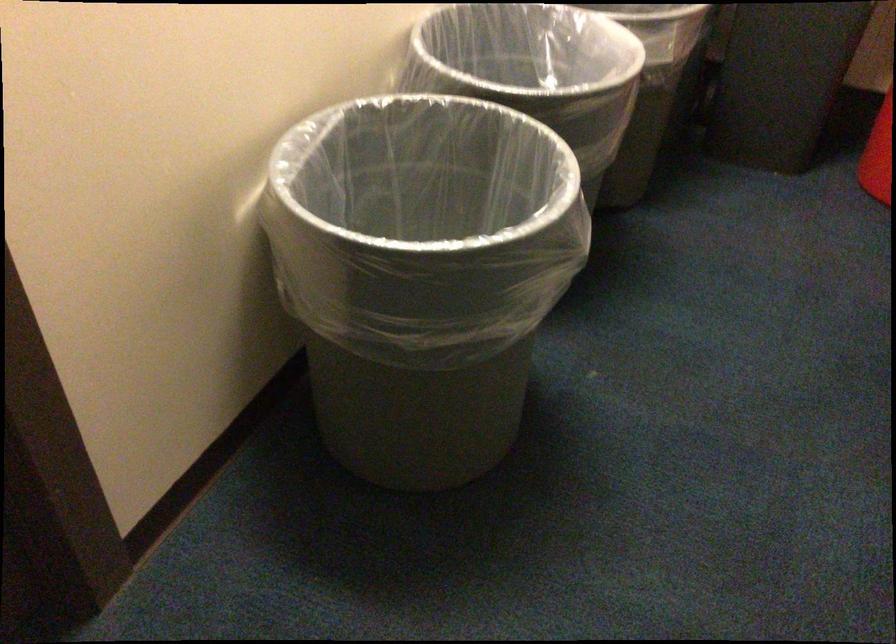
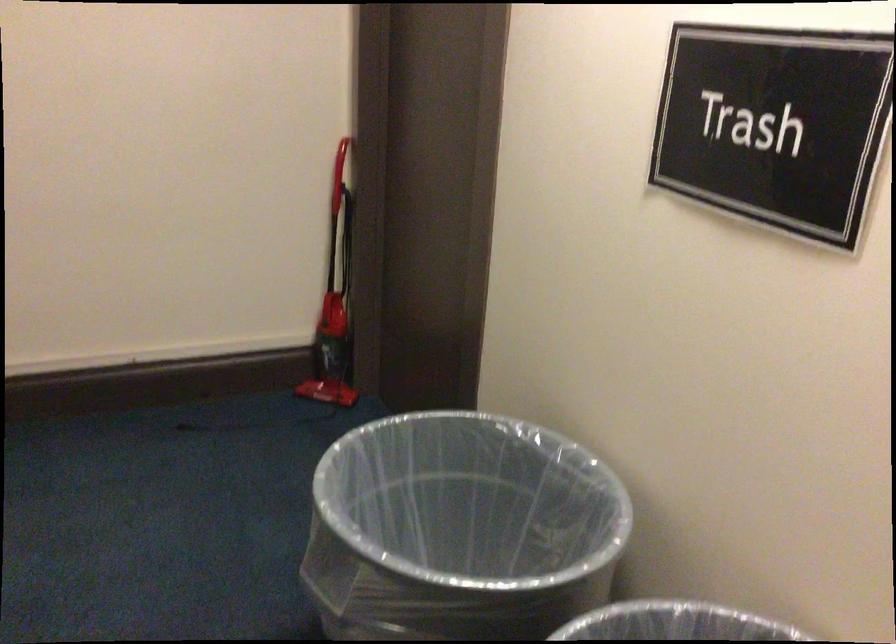
Find the pixel in the second image that matches [340,322] in the first image.

(460, 529)